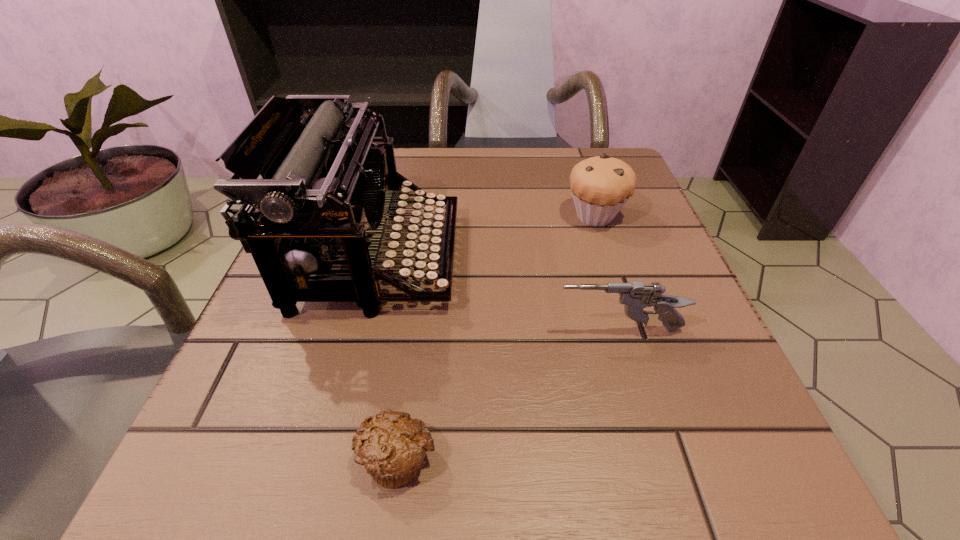
This screenshot has height=540, width=960. In the image, there is a desktop. Identify the location of free region at the right edge. (607, 322).

In order to click on free location at the far left corner of the desktop in this screenshot , I will do `click(401, 169)`.

This screenshot has height=540, width=960. I want to click on vacant area at the far right corner, so click(557, 161).

I want to click on free space between the farther muffin and the tallest object, so click(x=486, y=237).

Find the location of a particular element. vacant point located between the left muffin and the third tallest object is located at coordinates (509, 394).

Image resolution: width=960 pixels, height=540 pixels. I want to click on free point between the third tallest object and the tallest object, so click(497, 294).

Locate an element on the screen. unoccupied area between the shortest object and the typewriter is located at coordinates (387, 357).

You are a GUI agent. You are given a task and a screenshot of the screen. Output one action in this format:
    pyautogui.click(x=<x>, y=<y>)
    Task: Click on the free area in between the nearer muffin and the third shortest object
    
    Given the screenshot: What is the action you would take?
    pyautogui.click(x=496, y=337)

I want to click on free spot between the third tallest object and the second tallest object, so click(x=608, y=273).

You are a GUI agent. You are given a task and a screenshot of the screen. Output one action in this format:
    pyautogui.click(x=<x>, y=<y>)
    Task: Click on the unoccupied area between the farther muffin and the tallest object
    This screenshot has height=540, width=960.
    Given the screenshot: What is the action you would take?
    pyautogui.click(x=486, y=237)